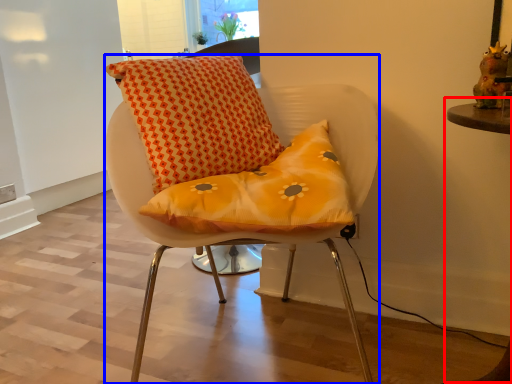
Question: Which object appears closest to the camera in this image, table (highlighted by a red box) or chair (highlighted by a blue box)?

Choices:
 (A) table
 (B) chair

Answer: (A)